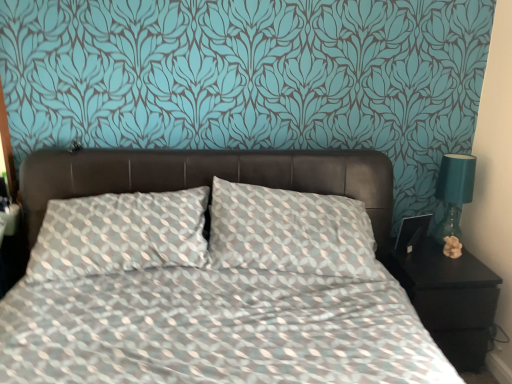
The height and width of the screenshot is (384, 512). I want to click on matte beige figurine at right, so click(452, 247).

Identify the location of teal glass lamp at right. tap(454, 198).

From a real-world perspective, is teal glass lamp at right positioned above or below black glossy nightstand at lower right?

teal glass lamp at right is above black glossy nightstand at lower right.

Are teal glass lamp at right and black glossy nightstand at lower right making contact?

They are not placed beside each other.

Considering the sizes of objects teal glass lamp at right and black glossy nightstand at lower right in the image provided, who is smaller, teal glass lamp at right or black glossy nightstand at lower right?

Smaller between the two is teal glass lamp at right.

From the image's perspective, is black glossy nightstand at lower right over teal glass lamp at right?

Actually, black glossy nightstand at lower right appears below teal glass lamp at right in the image.

Locate an element on the screen. The width and height of the screenshot is (512, 384). nightstand below the teal glass lamp at right (from the image's perspective) is located at coordinates (449, 299).

Is black glossy nightstand at lower right aimed at teal glass lamp at right?

No.

In terms of height, does black glossy nightstand at lower right look taller or shorter compared to teal glass lamp at right?

In the image, black glossy nightstand at lower right appears to be taller than teal glass lamp at right.

Is black glossy nightstand at lower right oriented towards matte beige figurine at right?

No, black glossy nightstand at lower right is not aimed at matte beige figurine at right.

Is black glossy nightstand at lower right positioned before matte beige figurine at right?

Yes, the depth of black glossy nightstand at lower right is less than that of matte beige figurine at right.

Are black glossy nightstand at lower right and matte beige figurine at right located far from each other?

No, there isn't a large distance between black glossy nightstand at lower right and matte beige figurine at right.

Is matte beige figurine at right positioned beyond the bounds of black glossy nightstand at lower right?

Indeed, matte beige figurine at right is completely outside black glossy nightstand at lower right.

From a real-world perspective, is matte beige figurine at right under black glossy nightstand at lower right?

No, from a real-world perspective, matte beige figurine at right is not below black glossy nightstand at lower right.

Considering the sizes of objects matte beige figurine at right and black glossy nightstand at lower right in the image provided, who is taller, matte beige figurine at right or black glossy nightstand at lower right?

Standing taller between the two is black glossy nightstand at lower right.

Looking at the image, does matte beige figurine at right seem bigger or smaller compared to black glossy nightstand at lower right?

matte beige figurine at right is smaller than black glossy nightstand at lower right.

Between teal glass lamp at right and matte beige figurine at right, which one is positioned in front?

teal glass lamp at right.

Consider the image. Which is less distant, (443, 250) or (452, 254)?

The point (452, 254) is more forward.

Consider the image. Is teal glass lamp at right bigger than matte beige figurine at right?

Indeed, teal glass lamp at right has a larger size compared to matte beige figurine at right.

Who is bigger, matte beige figurine at right or teal glass lamp at right?

Bigger between the two is teal glass lamp at right.

What are the coordinates of `flower beneath the teal glass lamp at right (from a real-world perspective)` in the screenshot? It's located at (452, 247).

Between matte beige figurine at right and teal glass lamp at right, which one has more height?

Standing taller between the two is teal glass lamp at right.

From the image's perspective, which one is positioned lower, matte beige figurine at right or teal glass lamp at right?

From the image's view, matte beige figurine at right is below.

Locate an element on the screen. The image size is (512, 384). nightstand located on the left of teal glass lamp at right is located at coordinates (449, 299).

You are a GUI agent. You are given a task and a screenshot of the screen. Output one action in this format:
    pyautogui.click(x=<x>, y=<y>)
    Task: Click on the nightstand lying in front of the teal glass lamp at right
    This screenshot has height=384, width=512.
    Given the screenshot: What is the action you would take?
    click(x=449, y=299)

From the image, which object appears to be nearer to matte beige figurine at right, black glossy nightstand at lower right or teal glass lamp at right?

The object closer to matte beige figurine at right is teal glass lamp at right.

Which object lies nearer to the anchor point black glossy nightstand at lower right, teal glass lamp at right or matte beige figurine at right?

The object closer to black glossy nightstand at lower right is matte beige figurine at right.

Estimate the real-world distances between objects in this image. Which object is further from teal glass lamp at right, black glossy nightstand at lower right or matte beige figurine at right?

black glossy nightstand at lower right is positioned further to the anchor teal glass lamp at right.

From the image, which object appears to be nearer to black glossy nightstand at lower right, matte beige figurine at right or teal glass lamp at right?

matte beige figurine at right lies closer to black glossy nightstand at lower right than the other object.

Based on their spatial positions, is matte beige figurine at right or black glossy nightstand at lower right closer to teal glass lamp at right?

matte beige figurine at right is positioned closer to the anchor teal glass lamp at right.

When comparing their distances from matte beige figurine at right, does teal glass lamp at right or black glossy nightstand at lower right seem closer?

teal glass lamp at right lies closer to matte beige figurine at right than the other object.

The image size is (512, 384). What are the coordinates of `flower between teal glass lamp at right and black glossy nightstand at lower right vertically` in the screenshot? It's located at (452, 247).